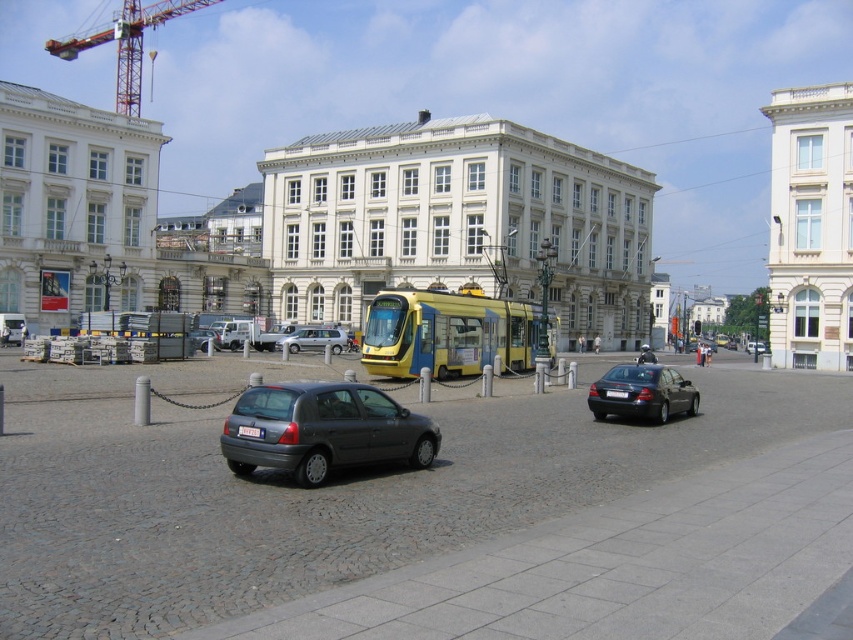
Question: Which of the following is the closest to the observer?

Choices:
 (A) (190, 0)
 (B) (196, 337)
 (C) (277, 349)
 (D) (368, 310)

Answer: (D)

Question: Is shiny black sedan at center smaller than silver metallic hatchback at center?

Choices:
 (A) no
 (B) yes

Answer: (A)

Question: Observing the image, what is the correct spatial positioning of matte gray hatchback at center-left in reference to yellow metallic tram at center?

Choices:
 (A) below
 (B) above

Answer: (A)

Question: Is the position of yellow metallic tram at center less distant than that of orange metallic crane at upper left?

Choices:
 (A) no
 (B) yes

Answer: (B)

Question: Considering the real-world distances, which object is farthest from the silver metallic hatchback at center?

Choices:
 (A) matte gray hatchback at center
 (B) shiny black sedan at center
 (C) matte gray hatchback at center-left

Answer: (C)

Question: Which point is farther from the camera taking this photo?

Choices:
 (A) (613, 372)
 (B) (285, 406)
 (C) (376, 339)

Answer: (C)